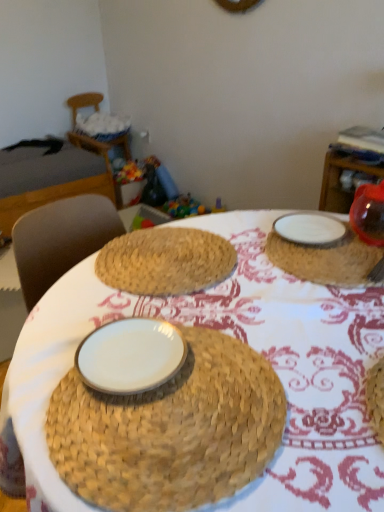
Question: Can you confirm if white woven basket at upper left is wider than white ceramic plate at upper right?

Choices:
 (A) no
 (B) yes

Answer: (A)

Question: Is white ceramic plate at upper right surrounded by white woven basket at upper left?

Choices:
 (A) no
 (B) yes

Answer: (A)

Question: Is white woven basket at upper left facing away from white ceramic plate at upper right?

Choices:
 (A) yes
 (B) no

Answer: (B)

Question: Does white woven basket at upper left lie in front of white ceramic plate at upper right?

Choices:
 (A) no
 (B) yes

Answer: (A)

Question: From a real-world perspective, is white woven basket at upper left below white ceramic plate at upper right?

Choices:
 (A) yes
 (B) no

Answer: (A)

Question: From the image's perspective, is white woven basket at upper left located beneath white ceramic plate at upper right?

Choices:
 (A) no
 (B) yes

Answer: (A)

Question: Considering the relative sizes of white woven basket at upper left and white glossy plate at center, the first plate in the front-to-back sequence, in the image provided, is white woven basket at upper left shorter than white glossy plate at center, the first plate in the front-to-back sequence,?

Choices:
 (A) no
 (B) yes

Answer: (A)

Question: From a real-world perspective, is white woven basket at upper left on top of white glossy plate at center, marked as the first plate in a left-to-right arrangement?

Choices:
 (A) yes
 (B) no

Answer: (B)

Question: Is white glossy plate at center, which is counted as the second plate, starting from the top, a part of white woven basket at upper left?

Choices:
 (A) yes
 (B) no

Answer: (B)

Question: Are white woven basket at upper left and white glossy plate at center, which is counted as the second plate, starting from the top, far apart?

Choices:
 (A) yes
 (B) no

Answer: (A)

Question: Does white woven basket at upper left touch white glossy plate at center, which ranks as the 1th plate in bottom-to-top order?

Choices:
 (A) yes
 (B) no

Answer: (B)

Question: Is white woven basket at upper left positioned beyond the bounds of white glossy plate at center, the first plate in the front-to-back sequence?

Choices:
 (A) yes
 (B) no

Answer: (A)

Question: Does white glossy plate at center, which ranks as the 1th plate in bottom-to-top order, come in front of white woven basket at upper left?

Choices:
 (A) no
 (B) yes

Answer: (B)